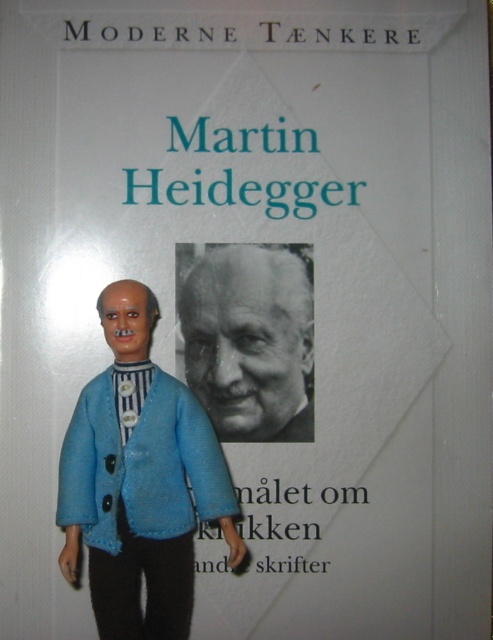
Can you confirm if blue fabric doll at center is positioned to the left of black and white photograph of martin heidegger at center?

Yes, blue fabric doll at center is to the left of black and white photograph of martin heidegger at center.

Is blue fabric doll at center taller than black and white photograph of martin heidegger at center?

Correct, blue fabric doll at center is much taller as black and white photograph of martin heidegger at center.

Between point (177, 515) and point (187, 284), which one is positioned behind?

Point (187, 284)

Image resolution: width=493 pixels, height=640 pixels. What are the coordinates of `blue fabric doll at center` in the screenshot? It's located at (140, 481).